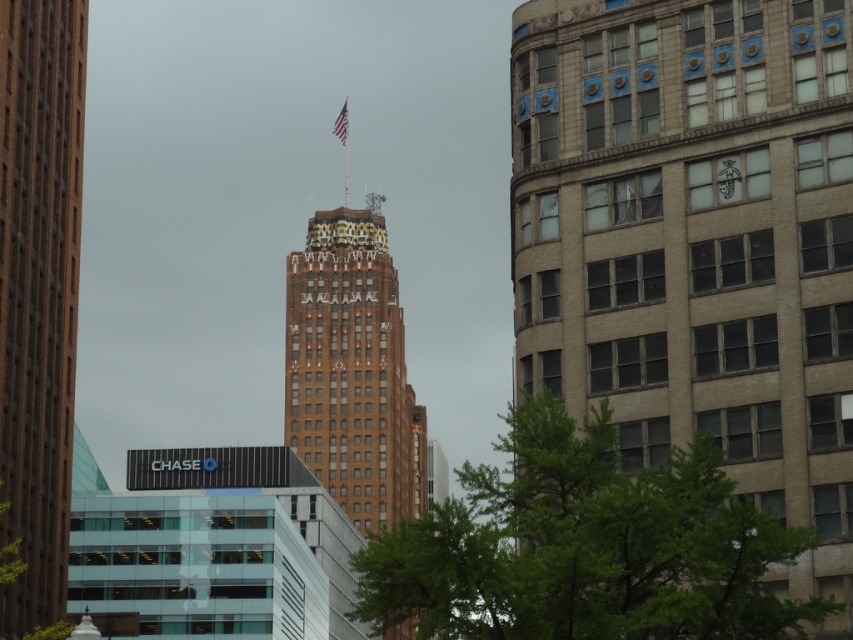
You are a city planner who needs to install a new communication tower between the brown stone building at center and the brown brick tower at center. The minimum required distance between the two structures for the tower to function properly is 80 feet. Based on the scene, will the proposed location meet the requirement?

The distance between the brown stone building at center and the brown brick tower at center is 79.21 feet, which is less than the required 80 feet. Therefore, the proposed location will not meet the requirement.

Based on the cityscape scene, where is the brown brick tower at center located in terms of its 2D coordinates?

The brown brick tower at center is located at the 2D coordinates point (x=38, y=292).